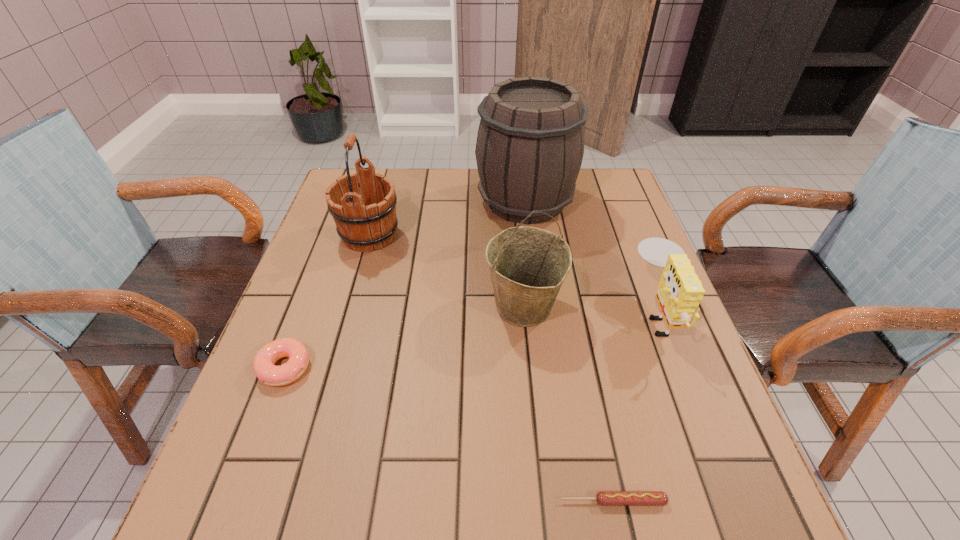
This screenshot has width=960, height=540. Identify the location of the leftmost wine bucket. [x=362, y=226].

Find the location of a particular element. This screenshot has width=960, height=540. the nearest wine bucket is located at coordinates (528, 265).

What are the coordinates of `sponge` in the screenshot? It's located at (680, 291).

The width and height of the screenshot is (960, 540). I want to click on the rightmost object, so click(680, 291).

Where is `the second shortest object`? the second shortest object is located at coordinates (268, 373).

Locate an element on the screen. The image size is (960, 540). the shortest object is located at coordinates (604, 498).

The width and height of the screenshot is (960, 540). I want to click on sausage, so click(x=604, y=498).

Find the location of `blank space located on the front of the leftmost wine bucket`. blank space located on the front of the leftmost wine bucket is located at coordinates [332, 366].

This screenshot has width=960, height=540. I want to click on vacant space positioned 0.070m on the back of the nearest wine bucket, so tap(518, 258).

Locate an element on the screen. This screenshot has height=540, width=960. vacant area located on the front-facing side of the fourth tallest object is located at coordinates (609, 314).